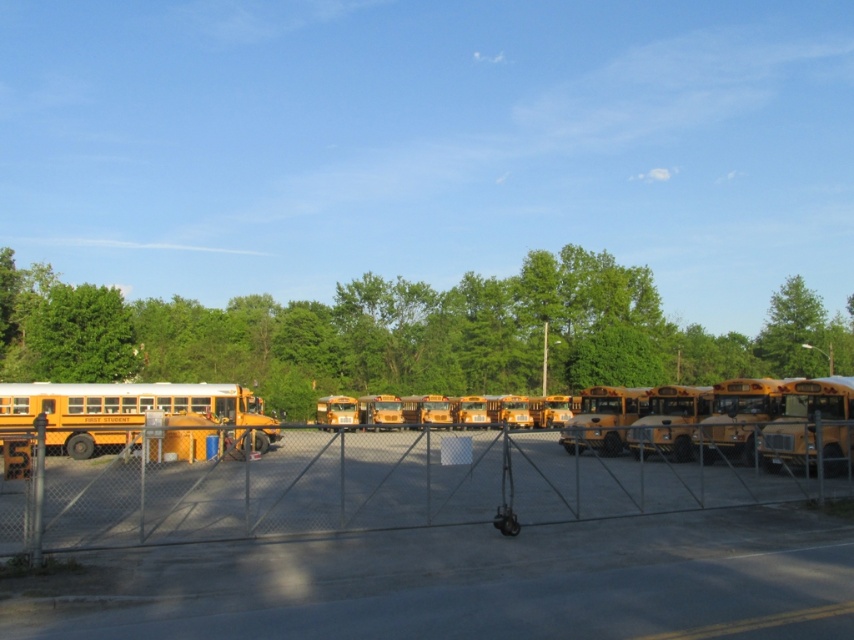
Question: Which of these objects is positioned closest to the matte yellow school bus at left?

Choices:
 (A) metallic chain-link fence at center
 (B) yellow matte school bus at right

Answer: (A)

Question: Which point is closer to the camera?

Choices:
 (A) yellow matte school bus at right
 (B) matte yellow school bus at left
 (C) metallic chain-link fence at center

Answer: (C)

Question: Can you confirm if metallic chain-link fence at center is thinner than yellow matte school bus at right?

Choices:
 (A) yes
 (B) no

Answer: (B)

Question: Is metallic chain-link fence at center behind matte yellow school bus at left?

Choices:
 (A) yes
 (B) no

Answer: (B)

Question: Can you confirm if metallic chain-link fence at center is wider than yellow matte school bus at right?

Choices:
 (A) yes
 (B) no

Answer: (A)

Question: Which of these objects is positioned farthest from the matte yellow school bus at left?

Choices:
 (A) metallic chain-link fence at center
 (B) yellow matte school bus at right

Answer: (B)